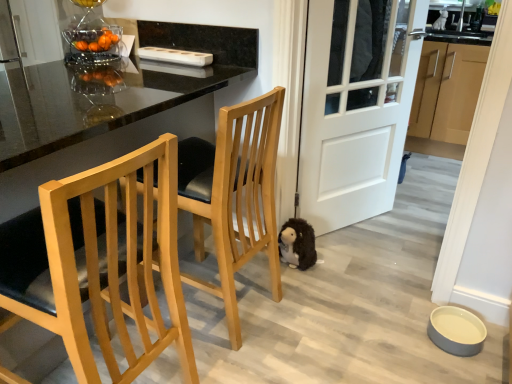
The image size is (512, 384). What do you see at coordinates (115, 264) in the screenshot? I see `light wood/texture chair at left, the second chair from the back` at bounding box center [115, 264].

In order to face glossy black table at center, should I rotate leftwards or rightwards?

A 22.955 degree turn to the left will do.

The image size is (512, 384). I want to click on light brown wood cabinets at right, so click(447, 91).

How distant is fuzzy brown stuffed animal at lower center from white matte door at center?

fuzzy brown stuffed animal at lower center is 22.75 inches from white matte door at center.

Does fuzzy brown stuffed animal at lower center appear on the left side of white matte door at center?

Yes, fuzzy brown stuffed animal at lower center is to the left of white matte door at center.

Does fuzzy brown stuffed animal at lower center have a lesser width compared to white matte door at center?

No, fuzzy brown stuffed animal at lower center is not thinner than white matte door at center.

Is fuzzy brown stuffed animal at lower center in front of or behind white matte door at center in the image?

fuzzy brown stuffed animal at lower center is behind white matte door at center.

Does glossy black table at center lie behind light wood/black cushioned seat at center, which is the second chair in front-to-back order?

A: No, glossy black table at center is closer to the camera.

Is glossy black table at center bigger or smaller than light wood/black cushioned seat at center, which is the second chair in front-to-back order?

glossy black table at center is bigger than light wood/black cushioned seat at center, which is the second chair in front-to-back order.

Is glossy black table at center next to light wood/black cushioned seat at center, which is the second chair in front-to-back order?

No, glossy black table at center is not beside light wood/black cushioned seat at center, which is the second chair in front-to-back order.

Between point (65, 138) and point (241, 192), which one is positioned in front?

The point (65, 138) is closer.

Is point (120, 160) closer or farther from the camera than point (433, 88)?

Point (120, 160) is closer to the camera than point (433, 88).

Is light wood/texture chair at left, the second chair from the back, positioned with its back to light brown wood cabinets at right?

No, light wood/texture chair at left, the second chair from the back,'s orientation is not away from light brown wood cabinets at right.

How many degrees apart are the facing directions of light wood/texture chair at left, the second chair from the back, and light brown wood cabinets at right?

The angle between the facing direction of light wood/texture chair at left, the second chair from the back, and the facing direction of light brown wood cabinets at right is 90.5 degrees.

From the image's perspective, count 2nd chairs downward from the light brown wood cabinets at right and point to it. Please provide its 2D coordinates.

[(115, 264)]

From a real-world perspective, is glossy black table at center physically above white matte door at center?

Actually, glossy black table at center is physically below white matte door at center in the real world.

Are glossy black table at center and white matte door at center beside each other?

glossy black table at center is not next to white matte door at center, and they're not touching.

Is white matte door at center a part of glossy black table at center?

No, white matte door at center is not surrounded by glossy black table at center.

I want to click on table above the fuzzy brown stuffed animal at lower center (from a real-world perspective), so click(110, 107).

Which of these two, glossy black table at center or fuzzy brown stuffed animal at lower center, is wider?

glossy black table at center.

Does glossy black table at center turn towards fuzzy brown stuffed animal at lower center?

No, glossy black table at center is not aimed at fuzzy brown stuffed animal at lower center.

From a real-world perspective, is glossy black table at center physically located above or below fuzzy brown stuffed animal at lower center?

From a real-world perspective, glossy black table at center is physically above fuzzy brown stuffed animal at lower center.

Between light brown wood cabinets at right and white matte door at center, which one has smaller size?

white matte door at center.

Does light brown wood cabinets at right turn towards white matte door at center?

Yes, light brown wood cabinets at right is turned towards white matte door at center.

What are the coordinates of `cabinetry behind the white matte door at center` in the screenshot? It's located at (447, 91).

Which object is positioned more to the right, light brown wood cabinets at right or white matte door at center?

Positioned to the right is light brown wood cabinets at right.

Can you confirm if white matte door at center is wider than glossy black table at center?

Incorrect, the width of white matte door at center does not surpass that of glossy black table at center.

Based on their sizes in the image, would you say white matte door at center is bigger or smaller than glossy black table at center?

Considering their sizes, white matte door at center takes up less space than glossy black table at center.

From a real-world perspective, which is physically below, white matte door at center or glossy black table at center?

In real-world perspective, glossy black table at center is lower.

Is white matte door at center to the left of glossy black table at center from the viewer's perspective?

No.

Locate an element on the screen. This screenshot has width=512, height=384. door that appears in front of the fuzzy brown stuffed animal at lower center is located at coordinates (355, 107).

Where is `chair that is the 1st one when counting downward from the glossy black table at center (from the image's perspective)`? The width and height of the screenshot is (512, 384). chair that is the 1st one when counting downward from the glossy black table at center (from the image's perspective) is located at coordinates (234, 195).

From the image, which object appears to be nearer to glossy black table at center, fuzzy brown stuffed animal at lower center or light wood/black cushioned seat at center, which appears as the 1th chair when viewed from the back?

light wood/black cushioned seat at center, which appears as the 1th chair when viewed from the back, lies closer to glossy black table at center than the other object.

Looking at the image, which one is located further to light brown wood cabinets at right, fuzzy brown stuffed animal at lower center or white matte door at center?

fuzzy brown stuffed animal at lower center.

Looking at the image, which one is located further to white matte door at center, light wood/black cushioned seat at center, which is the second chair in front-to-back order, or light brown wood cabinets at right?

light brown wood cabinets at right lies further to white matte door at center than the other object.

Looking at the image, which one is located closer to light wood/texture chair at left, the second chair from the back, light brown wood cabinets at right or white matte door at center?

white matte door at center.

Which object lies further to the anchor point white matte door at center, light wood/black cushioned seat at center, which appears as the 1th chair when viewed from the back, or glossy black table at center?

Among the two, glossy black table at center is located further to white matte door at center.

Estimate the real-world distances between objects in this image. Which object is closer to light wood/black cushioned seat at center, which is the second chair in front-to-back order, fuzzy brown stuffed animal at lower center or white matte door at center?

The object closer to light wood/black cushioned seat at center, which is the second chair in front-to-back order, is fuzzy brown stuffed animal at lower center.

In the scene shown: From the image, which object appears to be farther from white matte door at center, light brown wood cabinets at right or light wood/black cushioned seat at center, which is the second chair in front-to-back order?

Among the two, light brown wood cabinets at right is located further to white matte door at center.

Looking at the image, which one is located closer to glossy black table at center, light brown wood cabinets at right or light wood/texture chair at left, the 1th chair in the front-to-back sequence?

The object closer to glossy black table at center is light wood/texture chair at left, the 1th chair in the front-to-back sequence.

Locate an element on the screen. The image size is (512, 384). table between light wood/texture chair at left, the second chair from the back, and light wood/black cushioned seat at center, which appears as the 1th chair when viewed from the back, along the z-axis is located at coordinates (110, 107).

This screenshot has height=384, width=512. What are the coordinates of `door between fuzzy brown stuffed animal at lower center and light brown wood cabinets at right from left to right` in the screenshot? It's located at (355, 107).

Where is `chair situated between light wood/texture chair at left, the second chair from the back, and white matte door at center from left to right`? The image size is (512, 384). chair situated between light wood/texture chair at left, the second chair from the back, and white matte door at center from left to right is located at coordinates (234, 195).

The width and height of the screenshot is (512, 384). Find the location of `door located between light wood/black cushioned seat at center, which appears as the 1th chair when viewed from the back, and fuzzy brown stuffed animal at lower center in the depth direction`. door located between light wood/black cushioned seat at center, which appears as the 1th chair when viewed from the back, and fuzzy brown stuffed animal at lower center in the depth direction is located at coordinates (355, 107).